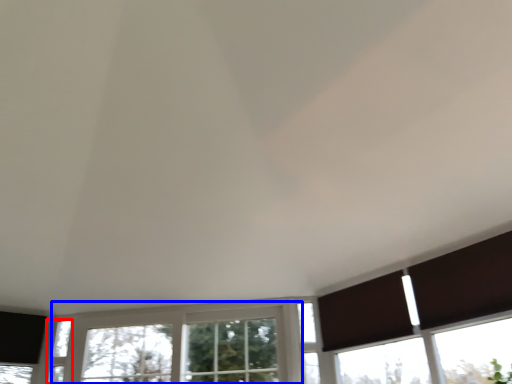
Question: Which object is further to the camera taking this photo, window (highlighted by a red box) or window (highlighted by a blue box)?

Choices:
 (A) window
 (B) window

Answer: (A)